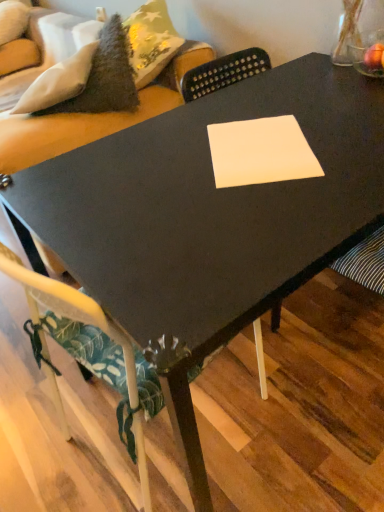
Question: From a real-world perspective, is velvet green couch at upper left on top of white paper at center?

Choices:
 (A) yes
 (B) no

Answer: (B)

Question: Is velvet green couch at upper left thinner than white paper at center?

Choices:
 (A) no
 (B) yes

Answer: (A)

Question: From the image's perspective, is velvet green couch at upper left beneath white paper at center?

Choices:
 (A) no
 (B) yes

Answer: (A)

Question: Does velvet green couch at upper left lie in front of white paper at center?

Choices:
 (A) yes
 (B) no

Answer: (B)

Question: Are velvet green couch at upper left and white paper at center making contact?

Choices:
 (A) no
 (B) yes

Answer: (A)

Question: Is velvet green couch at upper left to the left of white paper at center from the viewer's perspective?

Choices:
 (A) no
 (B) yes

Answer: (B)

Question: From the image's perspective, does white fabric chair at lower left appear higher than velvet green couch at upper left?

Choices:
 (A) yes
 (B) no

Answer: (B)

Question: Does white fabric chair at lower left contain velvet green couch at upper left?

Choices:
 (A) no
 (B) yes

Answer: (A)

Question: Is white fabric chair at lower left bigger than velvet green couch at upper left?

Choices:
 (A) yes
 (B) no

Answer: (B)

Question: Does white fabric chair at lower left appear on the left side of velvet green couch at upper left?

Choices:
 (A) yes
 (B) no

Answer: (B)

Question: Considering the relative sizes of white fabric chair at lower left and velvet green couch at upper left in the image provided, is white fabric chair at lower left smaller than velvet green couch at upper left?

Choices:
 (A) yes
 (B) no

Answer: (A)

Question: Does white fabric chair at lower left come behind velvet green couch at upper left?

Choices:
 (A) no
 (B) yes

Answer: (A)

Question: Is white paper at center directly adjacent to velvet green couch at upper left?

Choices:
 (A) no
 (B) yes

Answer: (A)